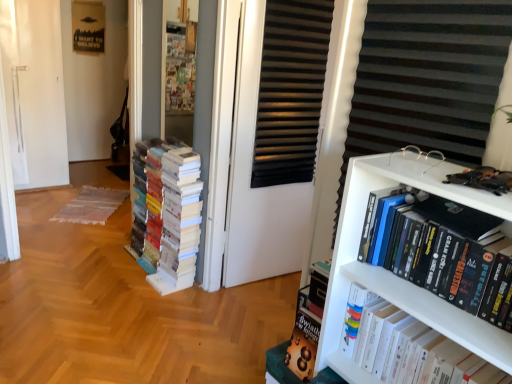
Question: Is white paper books at left, placed as the third book when sorted from right to left, outside of hardcover book at upper right, the second book from the back?

Choices:
 (A) yes
 (B) no

Answer: (A)

Question: Is white paper books at left, acting as the 1th book starting from the back, oriented away from hardcover book at upper right, the second book from the back?

Choices:
 (A) yes
 (B) no

Answer: (B)

Question: Can you confirm if white paper books at left, acting as the 1th book starting from the back, is wider than hardcover book at upper right, the second book from the back?

Choices:
 (A) no
 (B) yes

Answer: (B)

Question: Is white paper books at left, acting as the 1th book starting from the back, at the right side of hardcover book at upper right, marked as the second book in a front-to-back arrangement?

Choices:
 (A) no
 (B) yes

Answer: (A)

Question: Considering the relative positions of white paper books at left, placed as the third book when sorted from right to left, and hardcover book at upper right, the second book from the back, in the image provided, is white paper books at left, placed as the third book when sorted from right to left, to the left of hardcover book at upper right, the second book from the back, from the viewer's perspective?

Choices:
 (A) no
 (B) yes

Answer: (B)

Question: From a real-world perspective, is white paper books at left, which is the third book from front to back, above or below hardcover book at upper right, marked as the second book in a front-to-back arrangement?

Choices:
 (A) above
 (B) below

Answer: (B)

Question: Is white paper books at left, which is the third book from front to back, taller or shorter than hardcover book at upper right, the second book from the back?

Choices:
 (A) tall
 (B) short

Answer: (A)

Question: From the image's perspective, is white paper books at left, which is the third book from front to back, above or below hardcover book at upper right, which is the second book in right-to-left order?

Choices:
 (A) above
 (B) below

Answer: (A)

Question: Considering the relative positions of white paper books at left, which is the third book from front to back, and hardcover book at upper right, which is the second book in right-to-left order, in the image provided, is white paper books at left, which is the third book from front to back, to the left or to the right of hardcover book at upper right, which is the second book in right-to-left order,?

Choices:
 (A) right
 (B) left

Answer: (B)

Question: From a real-world perspective, relative to hardcover book at upper right, which is the second book in right-to-left order, is black matte screen door at center vertically above or below?

Choices:
 (A) above
 (B) below

Answer: (A)

Question: Considering the positions of black matte screen door at center and hardcover book at upper right, the second book from the back, in the image, is black matte screen door at center taller or shorter than hardcover book at upper right, the second book from the back,?

Choices:
 (A) tall
 (B) short

Answer: (A)

Question: Looking at their shapes, would you say black matte screen door at center is wider or thinner than hardcover book at upper right, marked as the second book in a front-to-back arrangement?

Choices:
 (A) wide
 (B) thin

Answer: (B)

Question: Is black matte screen door at center in front of or behind hardcover book at upper right, the second book from the back, in the image?

Choices:
 (A) behind
 (B) front

Answer: (A)

Question: Is hardcover book at upper right, positioned as the 2th book in left-to-right order, bigger or smaller than hardcover books at right, which is counted as the first book, starting from the front?

Choices:
 (A) big
 (B) small

Answer: (A)

Question: Relative to hardcover books at right, which appears as the 3th book when viewed from the back, is hardcover book at upper right, the second book from the back, in front or behind?

Choices:
 (A) behind
 (B) front

Answer: (A)